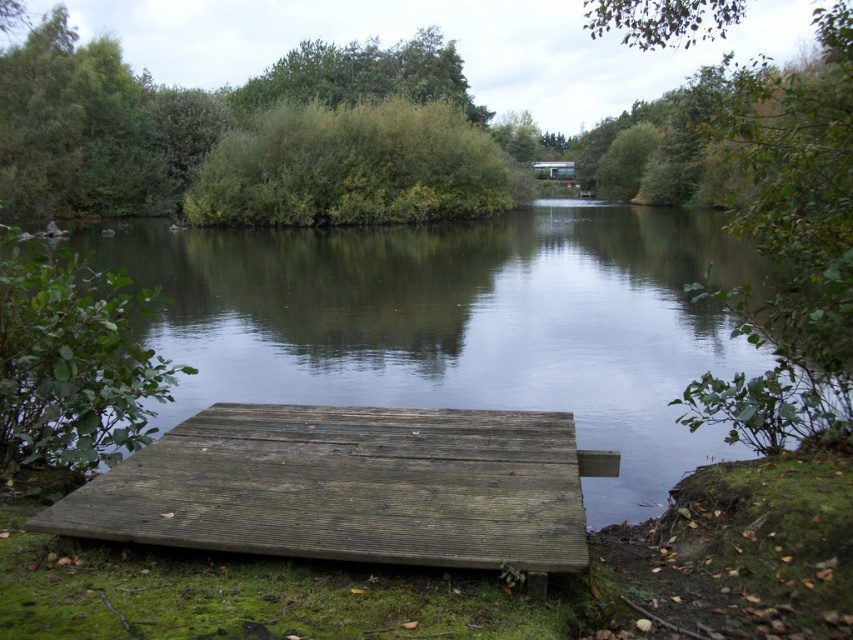
Question: Does greenish-brown wood at center have a smaller size compared to green leafy bush at center?

Choices:
 (A) yes
 (B) no

Answer: (B)

Question: Can you confirm if greenish-brown wood at center is positioned to the left of green leafy tree at upper center?

Choices:
 (A) yes
 (B) no

Answer: (B)

Question: Is weathered wood dock at lower center positioned in front of green leafy tree at upper center?

Choices:
 (A) yes
 (B) no

Answer: (A)

Question: Which point appears farthest from the camera in this image?

Choices:
 (A) (434, 42)
 (B) (579, 376)
 (C) (285, 212)

Answer: (A)

Question: Which object is positioned farthest from the green leafy bush at center?

Choices:
 (A) green leafy tree at upper center
 (B) greenish-brown wood at center

Answer: (A)

Question: Among these objects, which one is nearest to the camera?

Choices:
 (A) greenish-brown wood at center
 (B) green leafy tree at upper center

Answer: (A)